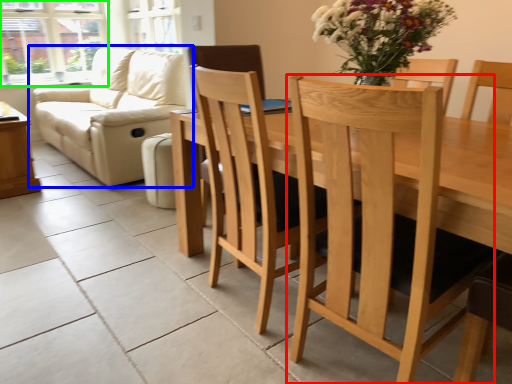
Question: Considering the real-world distances, which object is farthest from chair (highlighted by a red box)? studio couch (highlighted by a blue box) or window (highlighted by a green box)?

Choices:
 (A) studio couch
 (B) window

Answer: (B)